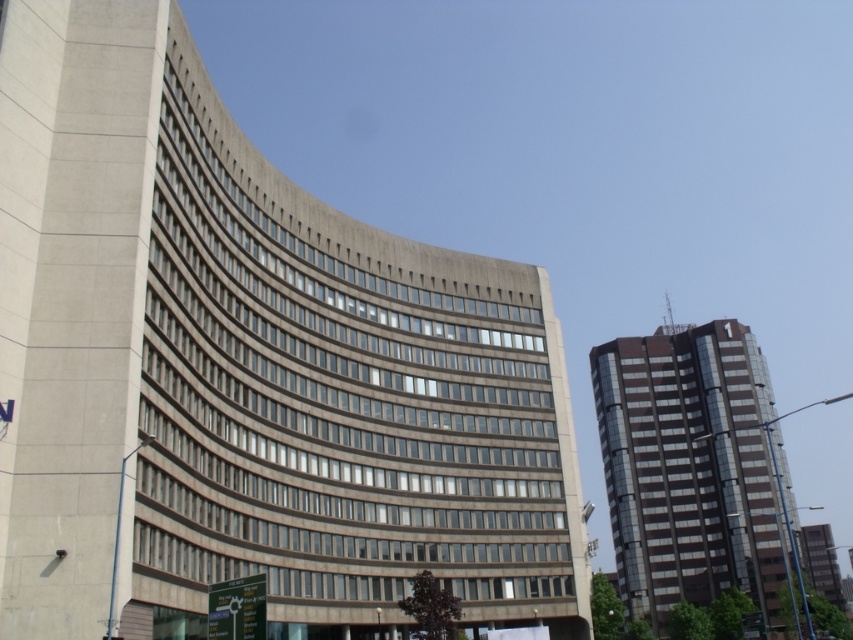
Question: Is concrete building at center thinner than shiny glass building at right?

Choices:
 (A) no
 (B) yes

Answer: (B)

Question: Which object is positioned farthest from the glassy reflective tower at right?

Choices:
 (A) shiny glass building at right
 (B) concrete building at center

Answer: (B)

Question: Is concrete building at center bigger than glassy reflective tower at right?

Choices:
 (A) no
 (B) yes

Answer: (B)

Question: Among these objects, which one is nearest to the camera?

Choices:
 (A) glassy reflective tower at right
 (B) concrete building at center

Answer: (B)

Question: Does concrete building at center have a smaller size compared to shiny glass building at right?

Choices:
 (A) yes
 (B) no

Answer: (A)

Question: Which point appears closest to the camera in this image?

Choices:
 (A) (669, 436)
 (B) (107, 540)
 (C) (840, 595)

Answer: (B)